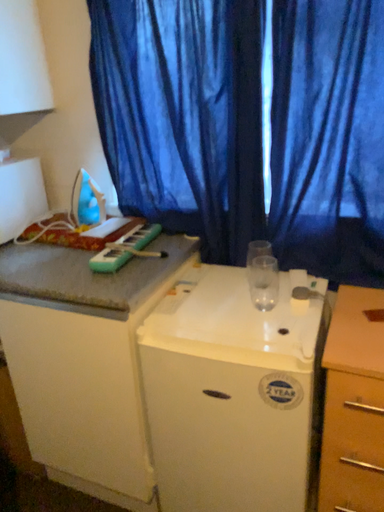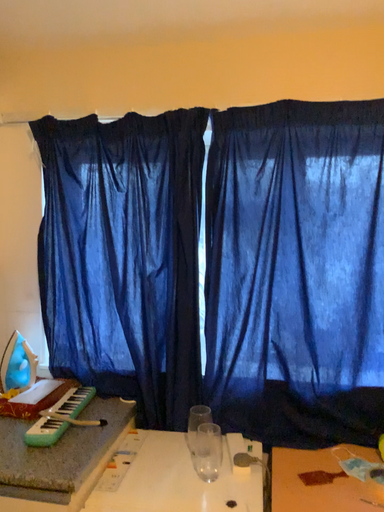
Question: Which way did the camera rotate in the video?

Choices:
 (A) rotated upward
 (B) rotated downward

Answer: (A)